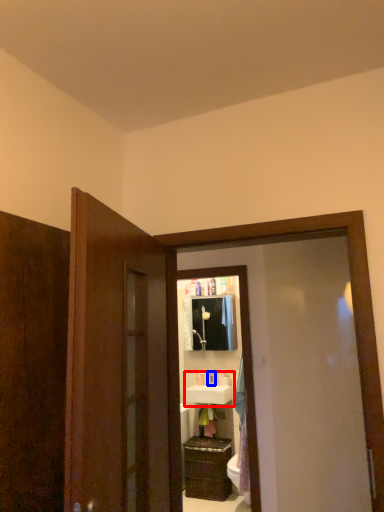
Question: Which point is closer to the camera, sink (highlighted by a red box) or toiletry (highlighted by a blue box)?

Choices:
 (A) sink
 (B) toiletry

Answer: (A)